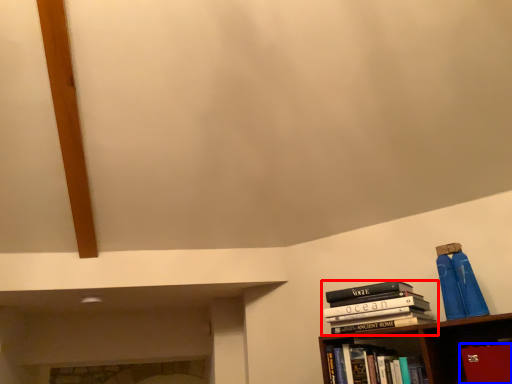
Question: Which of the following is the closest to the observer, book (highlighted by a red box) or paperback book (highlighted by a blue box)?

Choices:
 (A) book
 (B) paperback book

Answer: (B)